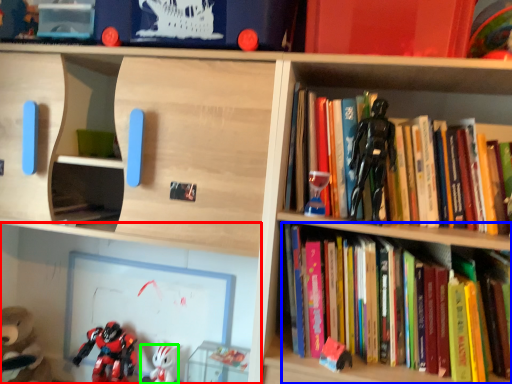
Question: Estimate the real-world distances between objects in this image. Which object is farther from shelf (highlighted by a red box), book (highlighted by a blue box) or toy (highlighted by a green box)?

Choices:
 (A) book
 (B) toy

Answer: (A)